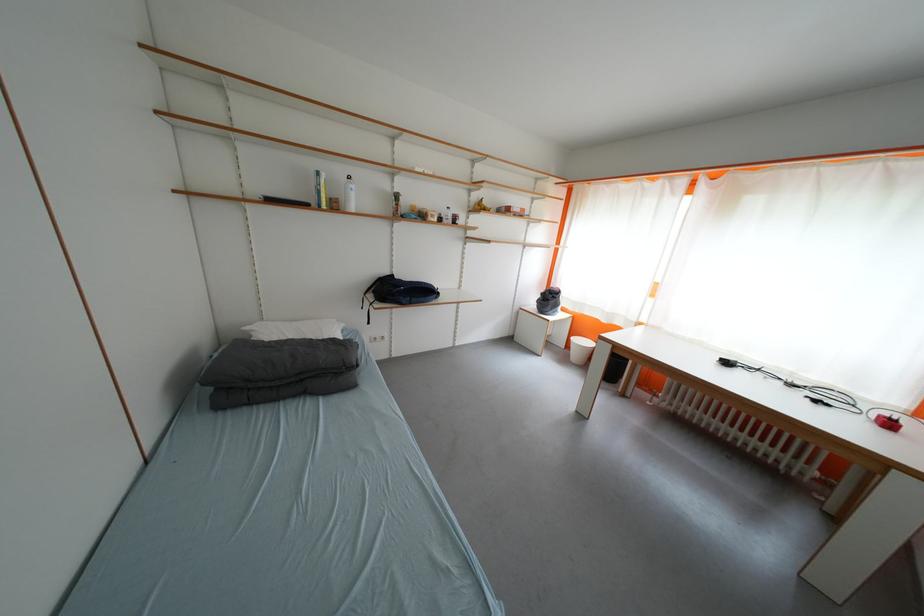
Where is `white pillow`? white pillow is located at coordinates (295, 329).